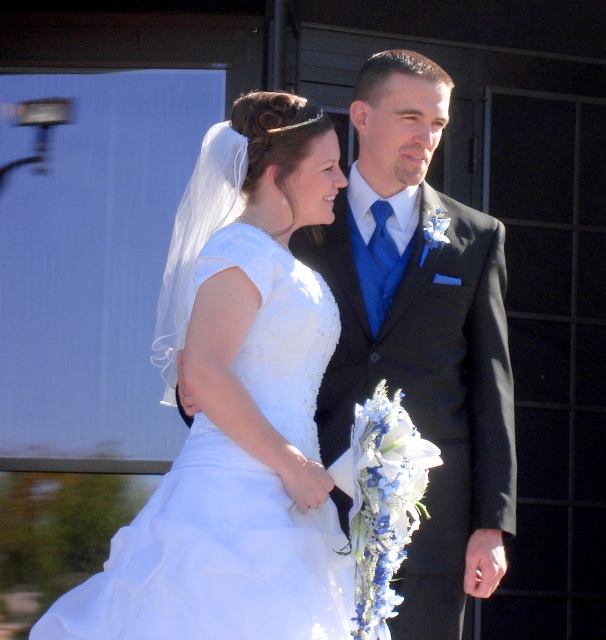
You are a photographer at the wedding. You need to adjust the lighting to ensure both the shiny black suit at center and the white satin dress at center are visible. Which object should you focus on first to balance the exposure?

The shiny black suit at center is above the white satin dress at center, so you should focus on the white satin dress at center first to ensure it isn

You are a photographer taking pictures of the wedding couple. You notice two points in the scene at coordinates point (408,150) and point (281,401). Which point is closer to your camera?

Point (408,150) is further to the camera than point (281,401), so the closer point to the camera is point (281,401).

You are a photographer at a wedding. You need to capture a closeup shot of the shiny black suit at center and the white satin dress at center. The camera you are using has a minimum focusing distance of 28 inches. Can you take the photo without moving either of the subjects?

The shiny black suit at center is 28.56 inches away from the white satin dress at center. Since the minimum focusing distance of the camera is 28 inches, the camera can focus on both subjects as the distance between them is sufficient.